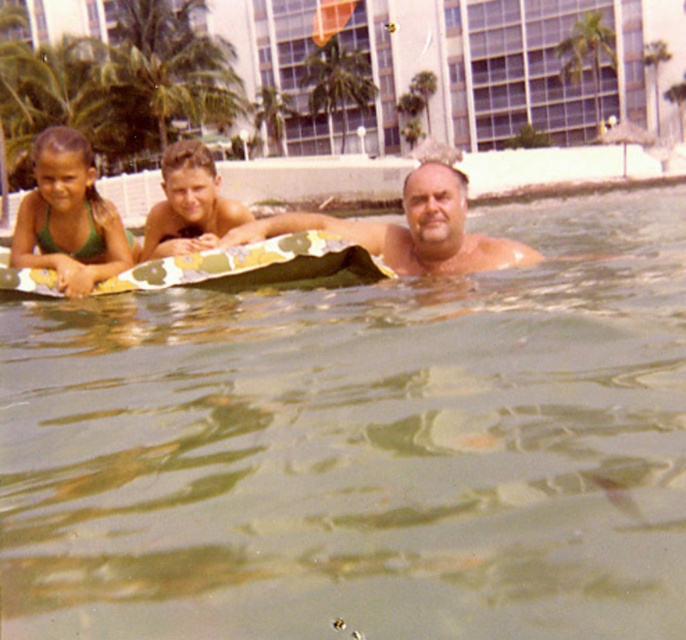
Question: Among these objects, which one is farthest from the camera?

Choices:
 (A) green fabric swimsuit at upper left
 (B) camouflage fabric surfboard at upper center

Answer: (A)

Question: Can you confirm if greenish murky water at center is wider than green fabric float at upper left?

Choices:
 (A) no
 (B) yes

Answer: (B)

Question: Estimate the real-world distances between objects in this image. Which object is closer to the smooth tan skin at center?

Choices:
 (A) green fabric swimsuit at upper left
 (B) green leafy palm tree at upper center

Answer: (A)

Question: Does smooth tan skin at center have a smaller size compared to green fabric swimsuit at upper left?

Choices:
 (A) yes
 (B) no

Answer: (B)

Question: Which of the following is the farthest from the observer?

Choices:
 (A) (153, 250)
 (B) (10, 428)

Answer: (A)

Question: Does green fabric swimsuit at upper left lie in front of green leafy palm tree at upper center?

Choices:
 (A) no
 (B) yes

Answer: (B)